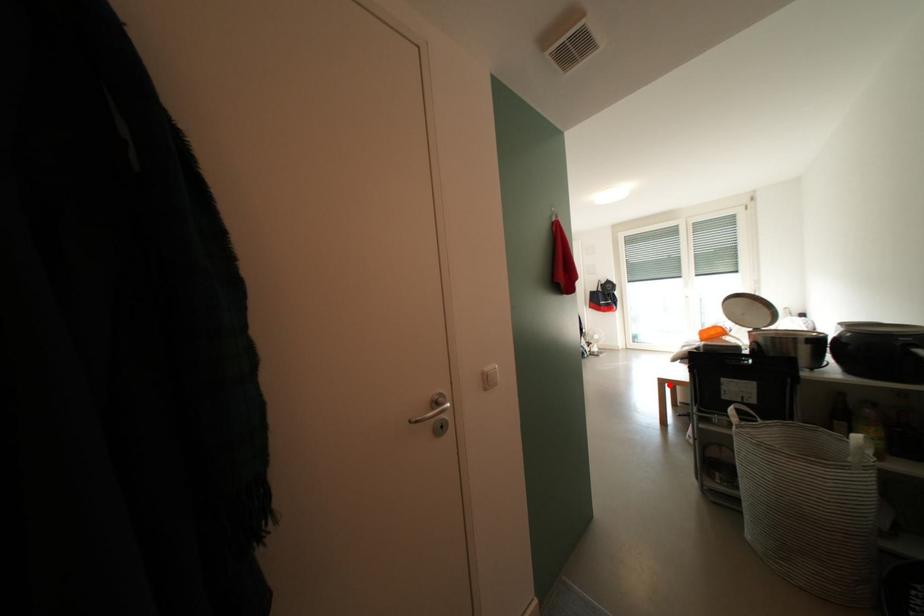
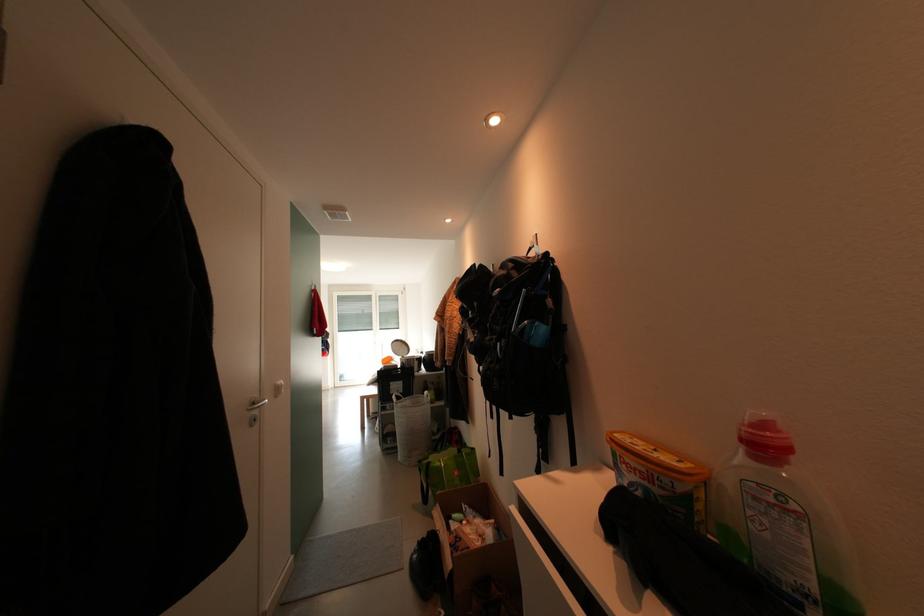
Find the pixel in the second image that matches the highlighted location in the first image.

(371, 400)